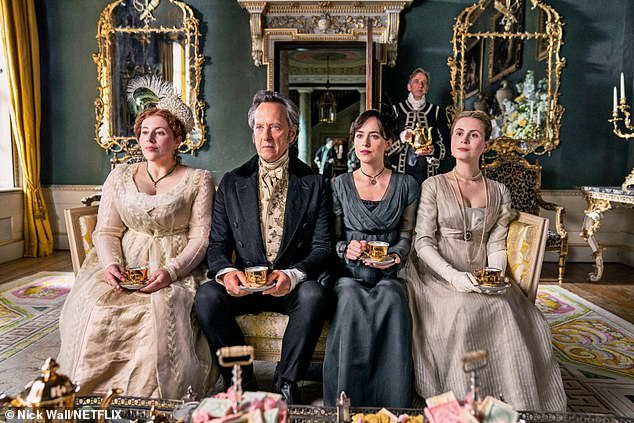
This screenshot has width=634, height=423. Find the location of `candlestick`. candlestick is located at coordinates (622, 89), (614, 96).